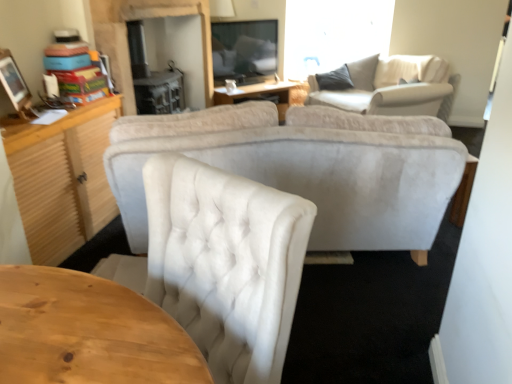
Question: Is light gray fabric couch at upper right inside the boundaries of wooden table at center, or outside?

Choices:
 (A) inside
 (B) outside

Answer: (B)

Question: From a real-world perspective, is light gray fabric couch at upper right above or below wooden table at center?

Choices:
 (A) below
 (B) above

Answer: (B)

Question: Which of these objects is positioned closest to the wooden table at center?

Choices:
 (A) light gray fabric couch at upper right
 (B) white tufted fabric chair at center

Answer: (A)

Question: Which object is the farthest from the wooden table at center?

Choices:
 (A) white tufted fabric chair at center
 (B) light gray fabric couch at upper right

Answer: (A)